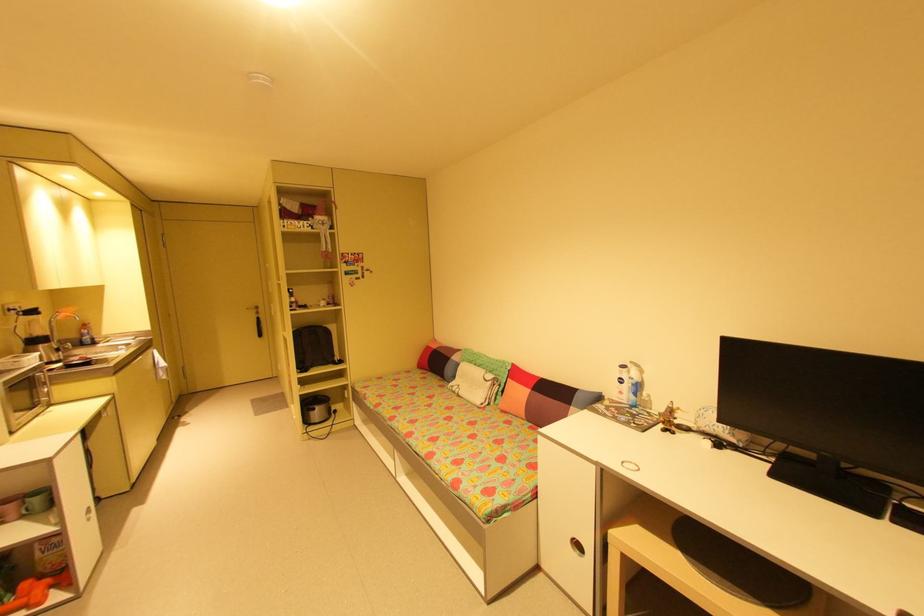
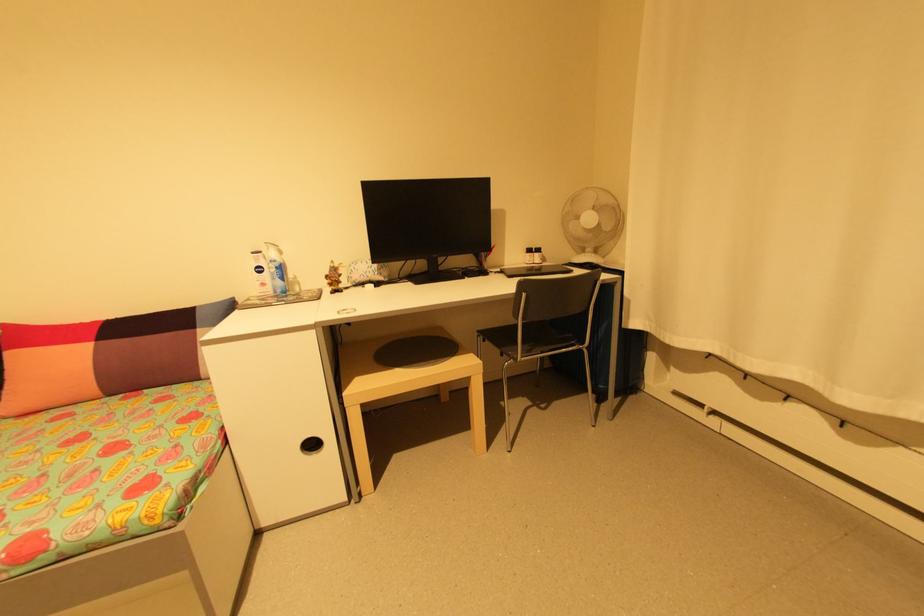
Find the pixel in the second image that matches point 582,546 in the first image.

(317, 446)